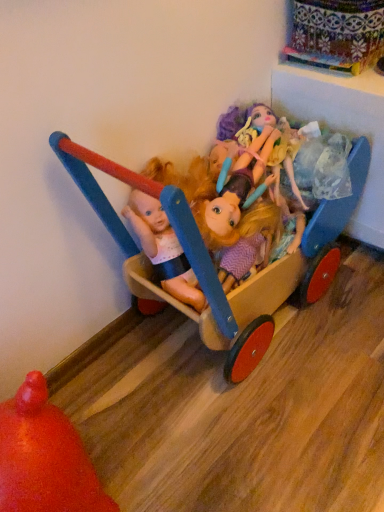
Question: Can you confirm if wooden cart at center, which appears as the second toy when viewed from the left, is taller than rubberized orange ball at lower left, which is the first toy from left to right?

Choices:
 (A) yes
 (B) no

Answer: (A)

Question: Is wooden cart at center, which appears as the second toy when viewed from the left, located outside rubberized orange ball at lower left, which is the second toy from right to left?

Choices:
 (A) no
 (B) yes

Answer: (B)

Question: From a real-world perspective, is wooden cart at center, which appears as the second toy when viewed from the left, under rubberized orange ball at lower left, which is the first toy from left to right?

Choices:
 (A) yes
 (B) no

Answer: (B)

Question: From a real-world perspective, is wooden cart at center, which appears as the second toy when viewed from the left, on top of rubberized orange ball at lower left, which is the first toy from left to right?

Choices:
 (A) no
 (B) yes

Answer: (B)

Question: Considering the relative sizes of wooden cart at center, marked as the first toy in a right-to-left arrangement, and rubberized orange ball at lower left, which is the first toy from left to right, in the image provided, is wooden cart at center, marked as the first toy in a right-to-left arrangement, smaller than rubberized orange ball at lower left, which is the first toy from left to right,?

Choices:
 (A) no
 (B) yes

Answer: (A)

Question: Looking at the image, does wooden cart at center, which appears as the second toy when viewed from the left, seem bigger or smaller compared to matte plastic dolls at center?

Choices:
 (A) small
 (B) big

Answer: (B)

Question: Is wooden cart at center, which appears as the second toy when viewed from the left, situated inside matte plastic dolls at center or outside?

Choices:
 (A) outside
 (B) inside

Answer: (A)

Question: Considering the positions of point (208, 344) and point (274, 203), is point (208, 344) closer or farther from the camera than point (274, 203)?

Choices:
 (A) farther
 (B) closer

Answer: (B)

Question: Looking at their shapes, would you say wooden cart at center, marked as the first toy in a right-to-left arrangement, is wider or thinner than matte plastic dolls at center?

Choices:
 (A) wide
 (B) thin

Answer: (A)

Question: From a real-world perspective, is rubberized orange ball at lower left, which is the first toy from left to right, positioned above or below matte plastic dolls at center?

Choices:
 (A) below
 (B) above

Answer: (A)

Question: Relative to matte plastic dolls at center, is rubberized orange ball at lower left, which is the second toy from right to left, in front or behind?

Choices:
 (A) front
 (B) behind

Answer: (A)

Question: Based on their sizes in the image, would you say rubberized orange ball at lower left, which is the second toy from right to left, is bigger or smaller than matte plastic dolls at center?

Choices:
 (A) small
 (B) big

Answer: (B)

Question: Considering the positions of rubberized orange ball at lower left, which is the first toy from left to right, and matte plastic dolls at center in the image, is rubberized orange ball at lower left, which is the first toy from left to right, wider or thinner than matte plastic dolls at center?

Choices:
 (A) wide
 (B) thin

Answer: (B)

Question: From the image's perspective, is matte plastic dolls at center above or below rubberized orange ball at lower left, which is the second toy from right to left?

Choices:
 (A) above
 (B) below

Answer: (A)

Question: In terms of width, does matte plastic dolls at center look wider or thinner when compared to rubberized orange ball at lower left, which is the second toy from right to left?

Choices:
 (A) thin
 (B) wide

Answer: (B)